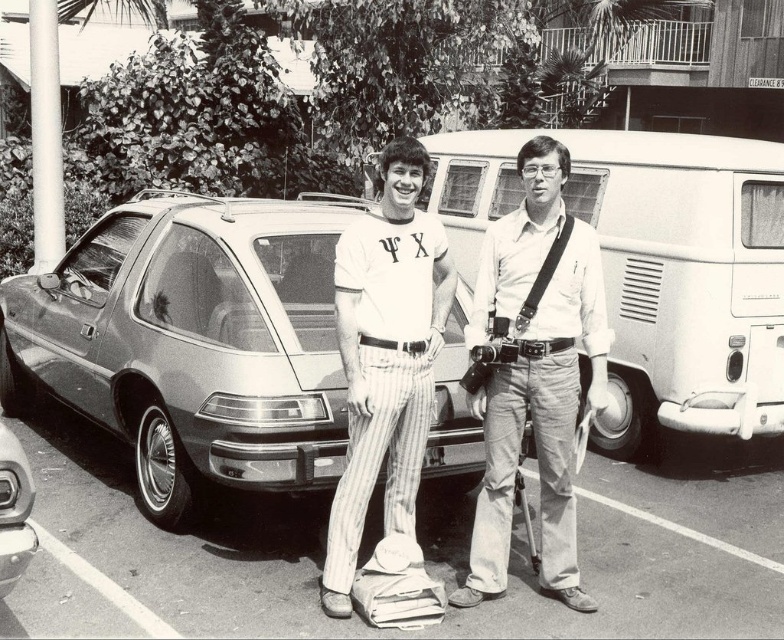
Looking at this image, where is the metallic silver minivan at center located in the image?

The metallic silver minivan at center is located at point [193,340] in the image.

You are standing at the position of the person on the left. You want to hand the rolled newspaper to the person on the right without moving from your spot. The white matte van at center is between you and them. Is the van in the way?

The white matte van at center is between you and the person on the right, so yes, the van is in the way.

You are trying to place a small potted plant between the smooth asphalt parking lot at center and the matte white shirt at center. Based on their positions, where would you place it?

The smooth asphalt parking lot at center is below matte white shirt at center, so the potted plant should be placed between them vertically, positioning it either above the parking lot or below the shirt depending on desired placement.